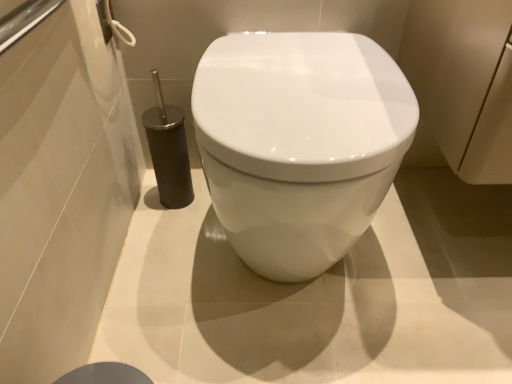
What do you see at coordinates (298, 143) in the screenshot? Image resolution: width=512 pixels, height=384 pixels. I see `white glossy toilet at center` at bounding box center [298, 143].

Find the location of a particular element. This screenshot has height=384, width=512. white glossy toilet at center is located at coordinates (298, 143).

Locate an element on the screen. The width and height of the screenshot is (512, 384). white glossy toilet at center is located at coordinates (298, 143).